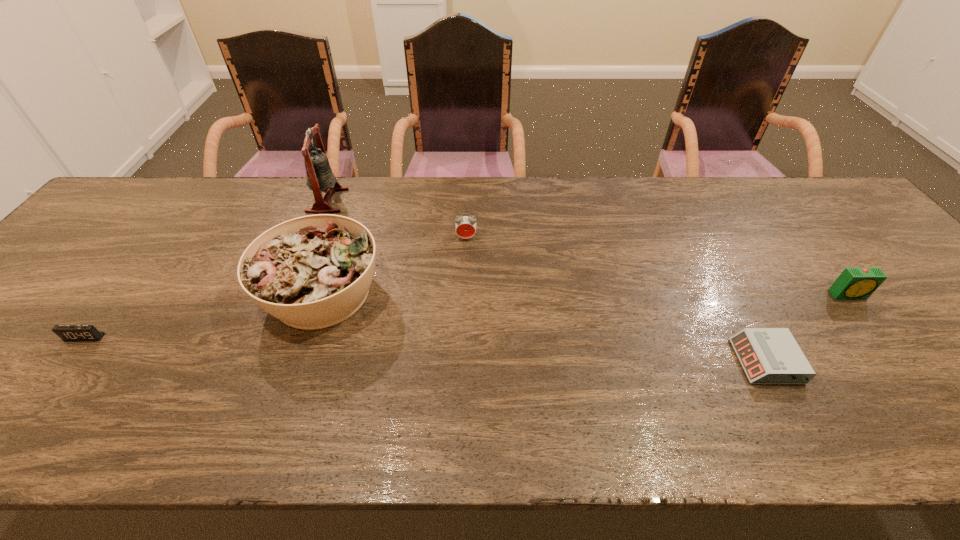
I want to click on bell, so click(x=320, y=177).

Locate an element on the screen. The height and width of the screenshot is (540, 960). the farthest object is located at coordinates (320, 177).

The image size is (960, 540). Identify the location of the second tallest object. click(x=312, y=272).

Locate an element on the screen. The height and width of the screenshot is (540, 960). the farthest alarm clock is located at coordinates (465, 226).

The width and height of the screenshot is (960, 540). Find the location of `the fourth object from left to right`. the fourth object from left to right is located at coordinates (465, 226).

This screenshot has height=540, width=960. What are the coordinates of `the rightmost alarm clock` in the screenshot? It's located at (854, 282).

You are a GUI agent. You are given a task and a screenshot of the screen. Output one action in this format:
    pyautogui.click(x=<x>, y=<y>)
    Task: Click on the third nearest alarm clock
    This screenshot has width=960, height=540.
    Given the screenshot: What is the action you would take?
    pyautogui.click(x=854, y=282)

At what (x,y) coordinates should I click in order to perform the action: click on the fifth object from left to right. Please return your answer as a coordinate pair (x, y). Looking at the image, I should click on (768, 355).

I want to click on the leftmost object, so click(x=66, y=332).

You are a GUI agent. You are given a task and a screenshot of the screen. Output one action in this format:
    pyautogui.click(x=<x>, y=<y>)
    Task: Click on the vacant space situated on the left of the tallest object
    This screenshot has height=540, width=960.
    Given the screenshot: What is the action you would take?
    pyautogui.click(x=268, y=200)